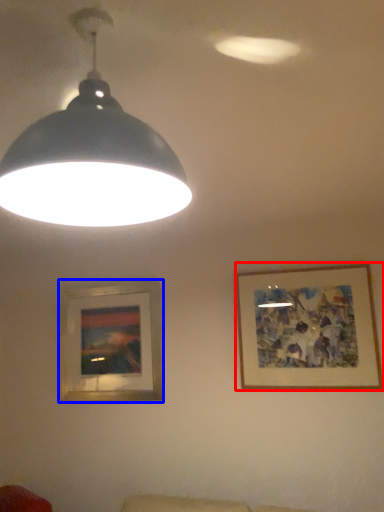
Question: Which object is further to the camera taking this photo, picture frame (highlighted by a red box) or picture frame (highlighted by a blue box)?

Choices:
 (A) picture frame
 (B) picture frame

Answer: (B)